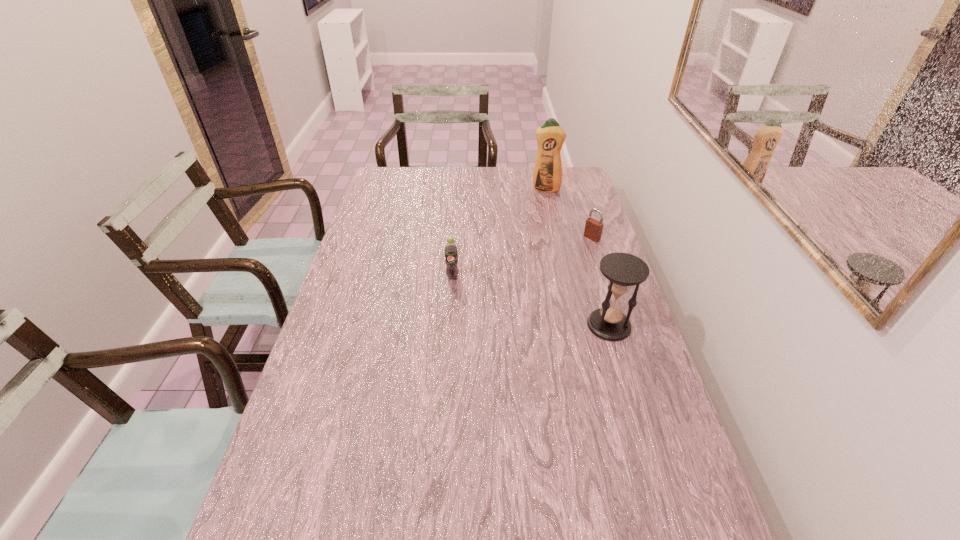
You are a GUI agent. You are given a task and a screenshot of the screen. Output one action in this format:
    pyautogui.click(x=<x>, y=<y>)
    Task: Click on the third tallest object
    This screenshot has height=540, width=960.
    Given the screenshot: What is the action you would take?
    pyautogui.click(x=451, y=251)

Locate an element on the screen. The width and height of the screenshot is (960, 540). the third farthest object is located at coordinates (451, 251).

Where is `the nearest object`? the nearest object is located at coordinates (622, 270).

The image size is (960, 540). Identify the location of hourglass. [622, 270].

Identify the location of the shortest object. (593, 229).

In order to click on the third nearest object in this screenshot , I will do `click(593, 229)`.

Locate an element on the screen. detergent is located at coordinates (547, 177).

At what (x,y) coordinates should I click in order to perform the action: click on the farthest object. Please return your answer as a coordinate pair (x, y). The width and height of the screenshot is (960, 540). Looking at the image, I should click on 547,177.

Where is `free location located 0.260m on the front label of the second nearest object`? The width and height of the screenshot is (960, 540). free location located 0.260m on the front label of the second nearest object is located at coordinates (447, 344).

I want to click on vacant point located on the front of the third shortest object, so click(651, 465).